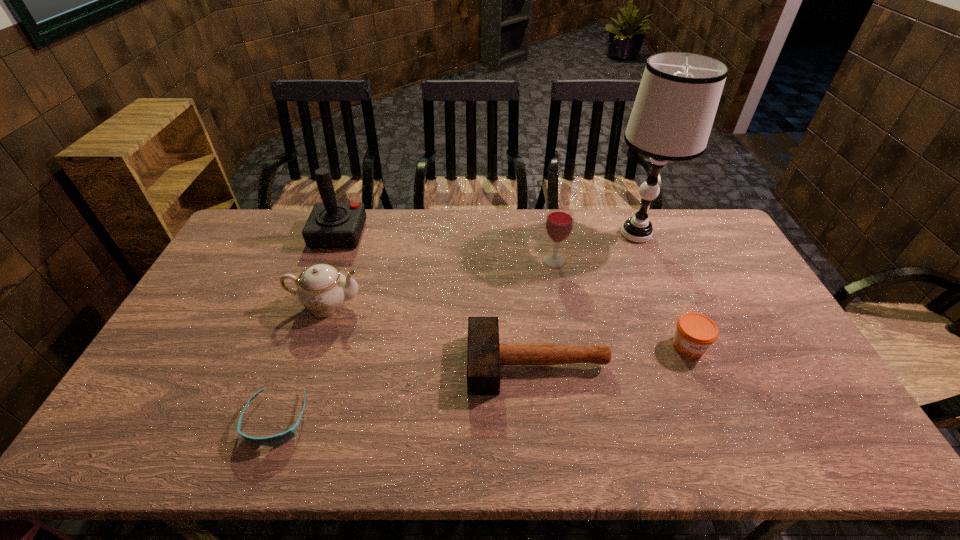
Image resolution: width=960 pixels, height=540 pixels. In order to click on table lamp in this screenshot , I will do `click(673, 113)`.

At what (x,y) coordinates should I click in order to perform the action: click on the second tallest object. Please return your answer as a coordinate pair (x, y). The height and width of the screenshot is (540, 960). Looking at the image, I should click on (331, 224).

You are a GUI agent. You are given a task and a screenshot of the screen. Output one action in this format:
    pyautogui.click(x=<x>, y=<y>)
    Task: Click on the wineglass
    This screenshot has width=960, height=540.
    Given the screenshot: What is the action you would take?
    pyautogui.click(x=559, y=221)

Locate an element on the screen. This screenshot has height=540, width=960. the fourth nearest object is located at coordinates (321, 288).

The image size is (960, 540). Find the location of `chinaware`. chinaware is located at coordinates click(x=321, y=288).

Image resolution: width=960 pixels, height=540 pixels. What are the coordinates of `jam` in the screenshot? It's located at (695, 333).

The height and width of the screenshot is (540, 960). Find the location of `mallet`. mallet is located at coordinates (485, 355).

Where is `the shortest object`? the shortest object is located at coordinates (275, 440).

Identify the location of free spot located 0.160m on the left of the table lamp. The image size is (960, 540). (560, 234).

The width and height of the screenshot is (960, 540). What are the coordinates of `free space located 0.100m on the base of the joystick` in the screenshot? It's located at (391, 234).